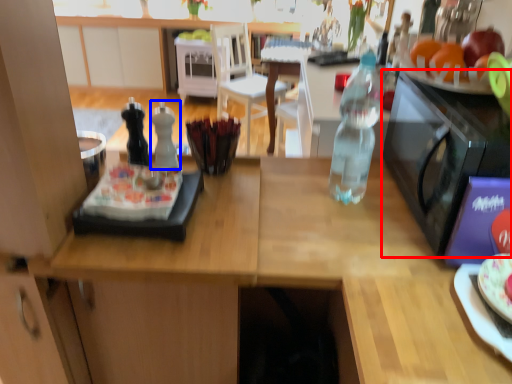
Question: Which of the following is the farthest to the observer, microwave oven (highlighted by a red box) or bottle (highlighted by a blue box)?

Choices:
 (A) microwave oven
 (B) bottle

Answer: (B)